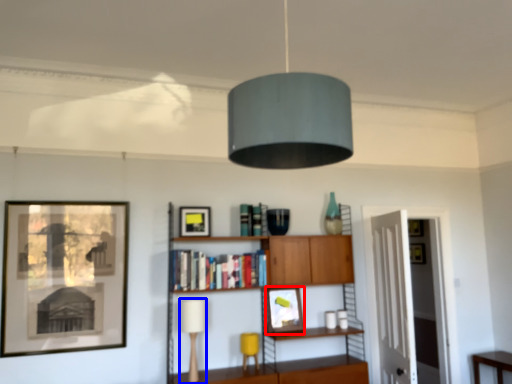
Question: Among these objects, which one is nearest to the camera, picture frame (highlighted by a red box) or table lamp (highlighted by a blue box)?

Choices:
 (A) picture frame
 (B) table lamp

Answer: (B)